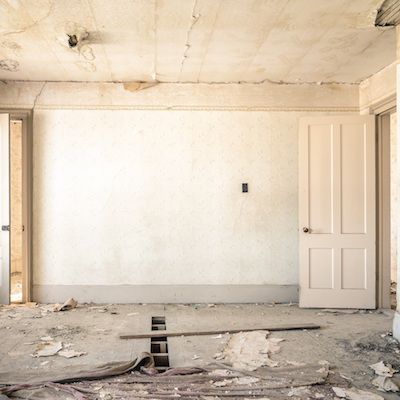
What are the coordinates of `hole in ceiling` in the screenshot? It's located at (74, 42).